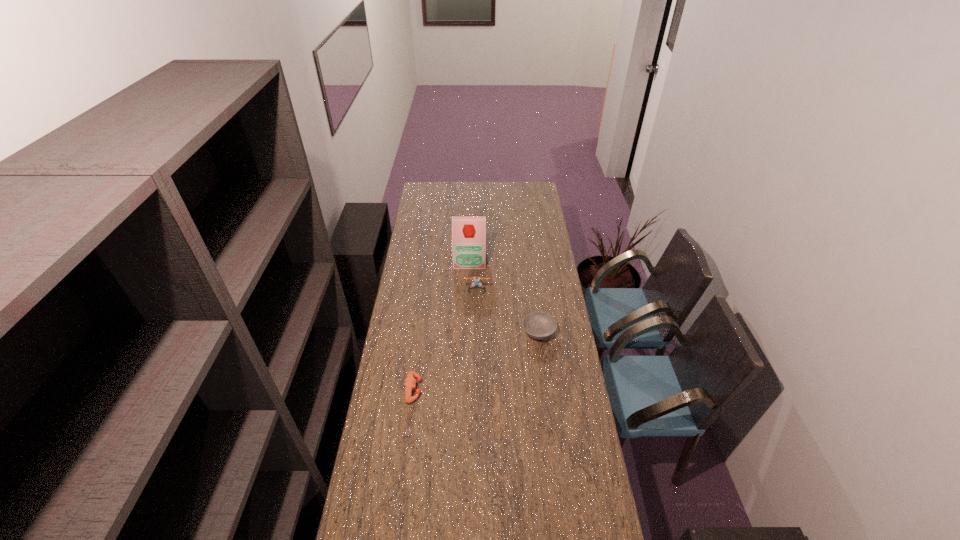
The image size is (960, 540). In order to click on vacant space situated on the back of the bowl in this screenshot , I will do `click(532, 284)`.

This screenshot has height=540, width=960. I want to click on vacant area situated with the gloves of the nearer puncher facing forward, so click(x=454, y=389).

You are a GUI agent. You are given a task and a screenshot of the screen. Output one action in this format:
    pyautogui.click(x=<x>, y=<y>)
    Task: Click on the object present at the left edge
    This screenshot has height=540, width=960.
    Given the screenshot: What is the action you would take?
    pyautogui.click(x=410, y=382)

Where is `object present at the right edge`? This screenshot has height=540, width=960. object present at the right edge is located at coordinates (538, 325).

Find the location of a particular element. Image resolution: width=960 pixels, height=540 pixels. vacant space at the far edge of the desktop is located at coordinates (463, 189).

Locate an element on the screen. Image resolution: width=960 pixels, height=540 pixels. vacant space at the left edge is located at coordinates (415, 240).

In the image, there is a desktop. Where is `vacant area at the right edge`? The image size is (960, 540). vacant area at the right edge is located at coordinates (559, 337).

The image size is (960, 540). I want to click on free region at the far left corner, so click(x=431, y=191).

Locate an element on the screen. vacant space at the far right corner of the desktop is located at coordinates (537, 190).

Locate an element on the screen. The image size is (960, 540). vacant area that lies between the second nearest object and the soya milk is located at coordinates (504, 295).